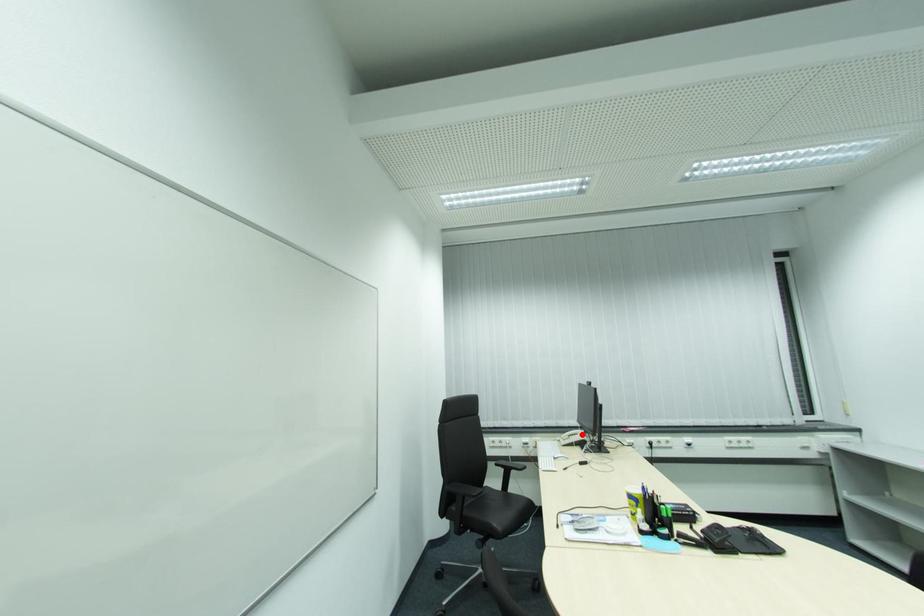
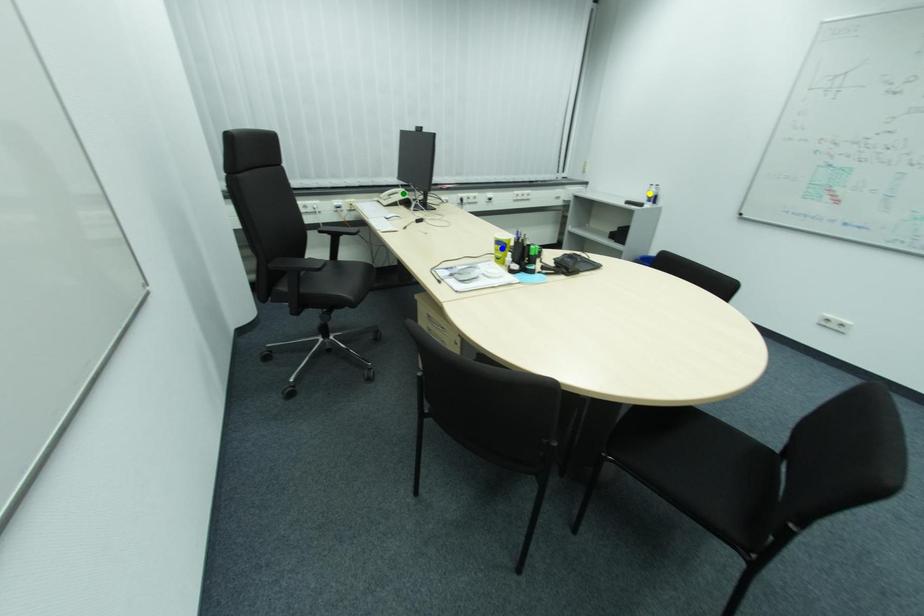
Question: I am providing you with two images of the same scene from different viewpoints. A red point is marked on the first image. You are given multiple points on the second image. Can you choose the point in image 2 that corresponds to the point in image 1?

Choices:
 (A) green point
 (B) blue point
 (C) yellow point

Answer: (A)